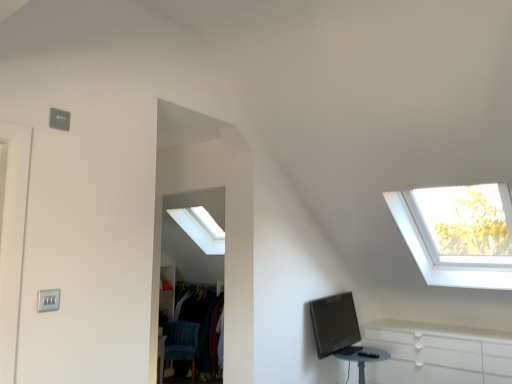
Question: From the image's perspective, relative to matte black table at lower right, is black glossy computer monitor at lower right above or below?

Choices:
 (A) above
 (B) below

Answer: (A)

Question: In terms of width, does black glossy computer monitor at lower right look wider or thinner when compared to matte black table at lower right?

Choices:
 (A) wide
 (B) thin

Answer: (B)

Question: Considering the real-world distances, which object is farthest from the velvet blue swivel chair at lower left?

Choices:
 (A) matte black table at lower right
 (B) satin silver switch at lower left
 (C) black glossy computer monitor at lower right

Answer: (B)

Question: Based on their relative distances, which object is farther from the matte black table at lower right?

Choices:
 (A) velvet blue swivel chair at lower left
 (B) satin silver switch at lower left
 (C) black glossy computer monitor at lower right

Answer: (B)